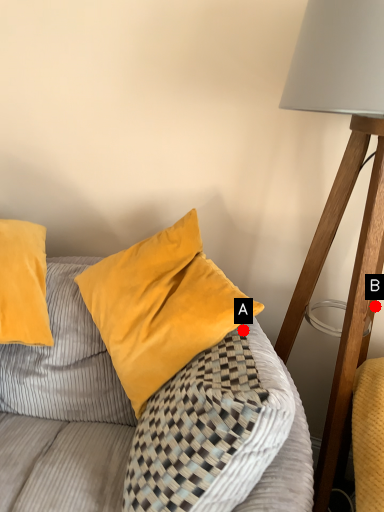
Question: Two points are circled on the image, labeled by A and B beside each circle. Which of the following is the closest to the observer?

Choices:
 (A) A is closer
 (B) B is closer

Answer: (B)